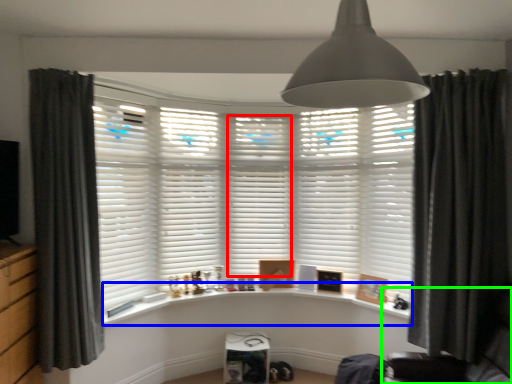
Question: Based on their relative distances, which object is nearer to shutter (highlighted by a red box)? Choose from window sill (highlighted by a blue box) and swivel chair (highlighted by a green box).

Choices:
 (A) window sill
 (B) swivel chair

Answer: (A)